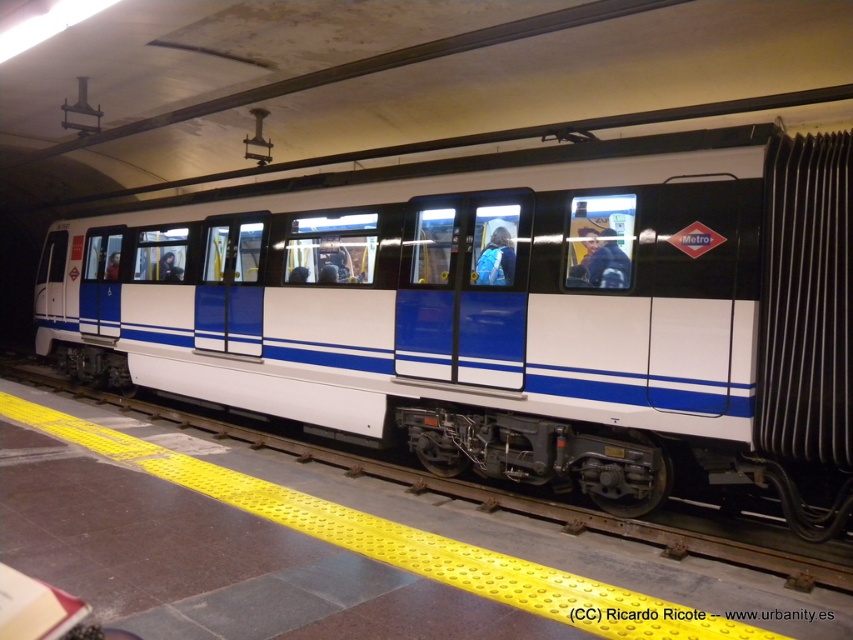
Which is above, white glossy train at center or dark blue fabric jacket at center?

dark blue fabric jacket at center is higher up.

Is white glossy train at center shorter than dark blue fabric jacket at center?

In fact, white glossy train at center may be taller than dark blue fabric jacket at center.

The height and width of the screenshot is (640, 853). What do you see at coordinates (506, 314) in the screenshot?
I see `white glossy train at center` at bounding box center [506, 314].

Find the location of a particular element. This screenshot has width=853, height=640. white glossy train at center is located at coordinates (506, 314).

Which is below, blue fabric backpack at center or dark blue fabric jacket at center?

blue fabric backpack at center is below.

Does point (508, 256) come behind point (161, 273)?

No, (508, 256) is closer to viewer.

Is point (502, 262) less distant than point (167, 278)?

Yes.

What are the coordinates of `blue fabric backpack at center` in the screenshot? It's located at (496, 259).

How distant is white glossy train at center from blue fabric backpack at center?

white glossy train at center is 6.77 feet from blue fabric backpack at center.

Is point (254, 214) in front of point (497, 234)?

No, it is behind (497, 234).

Where is `white glossy train at center`? The width and height of the screenshot is (853, 640). white glossy train at center is located at coordinates (506, 314).